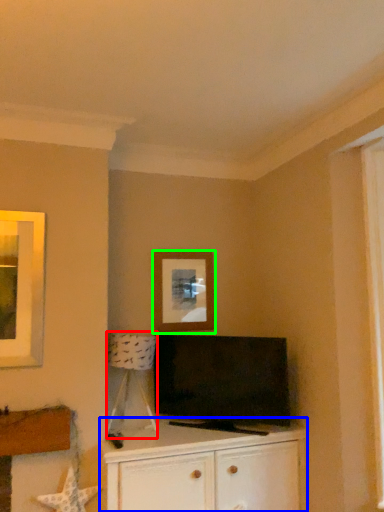
Question: Which object is positioned closest to lamp (highlighted by a red box)? Select from cabinetry (highlighted by a blue box) and picture frame (highlighted by a green box).

Choices:
 (A) cabinetry
 (B) picture frame

Answer: (B)